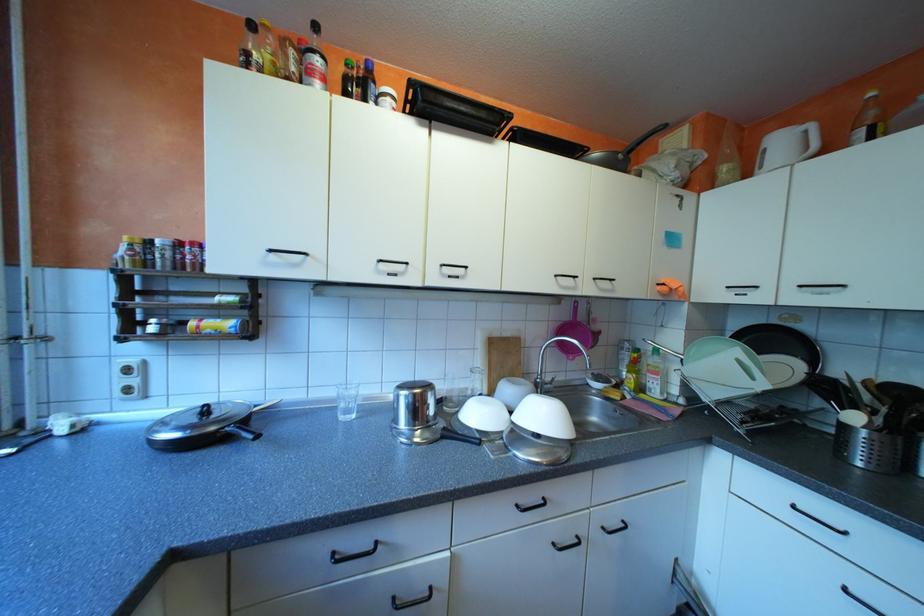
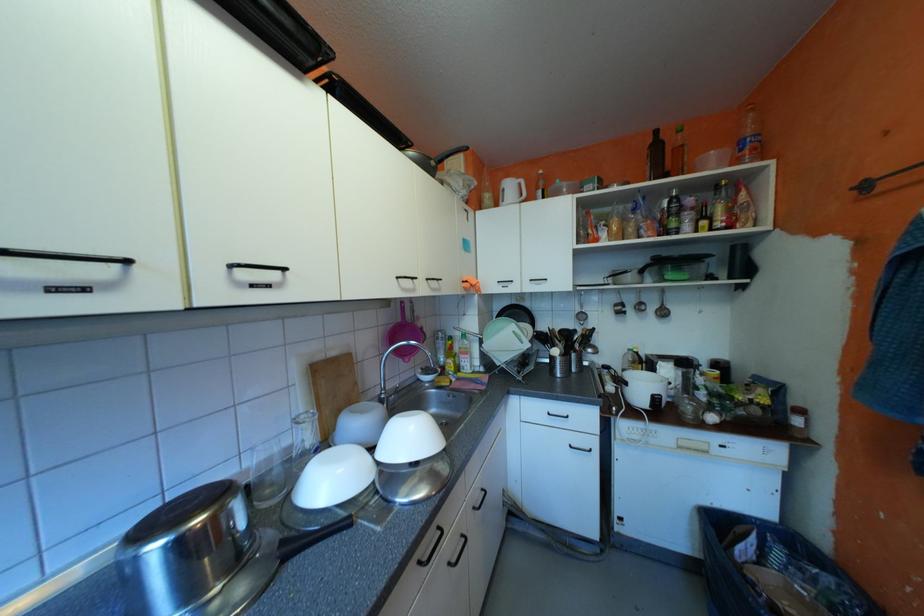
Question: The camera is either moving clockwise (left) or counter-clockwise (right) around the object. The first image is from the beginning of the video and the second image is from the end. Is the camera moving left or right when shooting the video?

Choices:
 (A) Left
 (B) Right

Answer: (A)